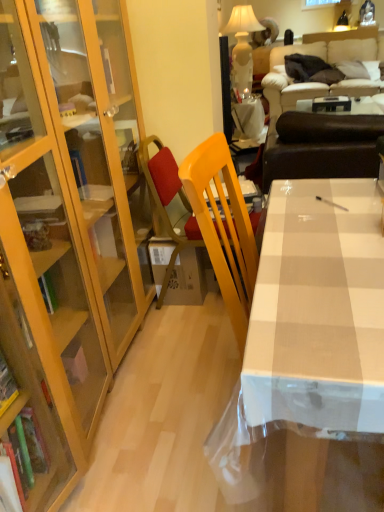
Where is `brown leather couch at upper right, the second studio couch viewed from the top`? The height and width of the screenshot is (512, 384). brown leather couch at upper right, the second studio couch viewed from the top is located at coordinates (321, 147).

What is the approximate height of white glossy table at center?

It is 3.38 feet.

Identify the location of yellow matte chair at center. pyautogui.click(x=168, y=201).

This screenshot has height=512, width=384. Describe the element at coordinates (326, 61) in the screenshot. I see `beige fabric couch at upper right, which ranks as the first studio couch in back-to-front order` at that location.

Image resolution: width=384 pixels, height=512 pixels. Describe the element at coordinates (242, 46) in the screenshot. I see `white ceramic lamp at upper center` at that location.

Measure the distance between white ceramic lamp at upper center and camera.

white ceramic lamp at upper center is 2.71 meters away from camera.

Find the location of a particular element. The height and width of the screenshot is (512, 384). white glossy table at upper center, which is the 1th table from back to front is located at coordinates (249, 119).

At what (x,y) coordinates should I click in order to perform the action: click on brown leather couch at upper right, acting as the first studio couch starting from the front. Please return your answer as a coordinate pair (x, y). The height and width of the screenshot is (512, 384). Looking at the image, I should click on (321, 147).

Is white glossy table at center wider or thinner than white glossy table at upper center, the second table viewed from the right?

Considering their sizes, white glossy table at center looks broader than white glossy table at upper center, the second table viewed from the right.

Which object is positioned more to the right, white glossy table at center or white glossy table at upper center, the second table in the front-to-back sequence?

From the viewer's perspective, white glossy table at upper center, the second table in the front-to-back sequence, appears more on the right side.

The image size is (384, 512). In order to click on desk on the left side of white glossy table at upper center, which is the 1th table from back to front in this screenshot , I will do `click(318, 310)`.

From the image's perspective, which is above, white glossy table at center or white glossy table at upper center, positioned as the first table in left-to-right order?

From the image's view, white glossy table at upper center, positioned as the first table in left-to-right order, is above.

Considering the sizes of objects yellow matte chair at center and white ceramic lamp at upper center in the image provided, who is shorter, yellow matte chair at center or white ceramic lamp at upper center?

yellow matte chair at center.

Considering their positions, is yellow matte chair at center located in front of or behind white ceramic lamp at upper center?

Clearly, yellow matte chair at center is in front of white ceramic lamp at upper center.

Choose the correct answer: Is yellow matte chair at center inside white ceramic lamp at upper center or outside it?

yellow matte chair at center is located beyond the bounds of white ceramic lamp at upper center.

Is yellow matte chair at center bigger than white ceramic lamp at upper center?

Incorrect, yellow matte chair at center is not larger than white ceramic lamp at upper center.

Looking at their sizes, would you say white glossy table at center is wider or thinner than white glossy table at center, the 1th table from the right?

In the image, white glossy table at center appears to be wider than white glossy table at center, the 1th table from the right.

From their relative heights in the image, would you say white glossy table at center is taller or shorter than white glossy table at center, marked as the 1th table in a front-to-back arrangement?

Clearly, white glossy table at center is taller compared to white glossy table at center, marked as the 1th table in a front-to-back arrangement.

Which is in front, point (320, 378) or point (302, 109)?

Point (320, 378)

Are white glossy table at center and white glossy table at center, the 1th table from the right, far apart?

Yes, white glossy table at center is far from white glossy table at center, the 1th table from the right.

You are a GUI agent. You are given a task and a screenshot of the screen. Output one action in this format:
    pyautogui.click(x=<x>, y=<y>)
    Task: Click on the studio couch that is the 1st object located above the white glossy table at center (from the image's perspective)
    This screenshot has height=512, width=384.
    Given the screenshot: What is the action you would take?
    (x=321, y=147)

Is brown leather couch at upper right, placed as the second studio couch when sorted from back to front, far away from white glossy table at center?

That's right, there is a large distance between brown leather couch at upper right, placed as the second studio couch when sorted from back to front, and white glossy table at center.

Could you measure the distance between brown leather couch at upper right, acting as the first studio couch starting from the front, and white glossy table at center?

They are 1.08 meters apart.

Based on the photo, who is shorter, brown leather couch at upper right, the second studio couch viewed from the top, or white glossy table at center?

Standing shorter between the two is brown leather couch at upper right, the second studio couch viewed from the top.

Can you confirm if white glossy table at center, the 1th table from the right, is positioned to the left of white ceramic lamp at upper center?

No.

From a real-world perspective, does white glossy table at center, the 1th table from the right, stand above white ceramic lamp at upper center?

Incorrect, from a real-world perspective, white glossy table at center, the 1th table from the right, is lower than white ceramic lamp at upper center.

Could you tell me if white glossy table at center, marked as the 1th table in a front-to-back arrangement, is facing white ceramic lamp at upper center?

No.

The image size is (384, 512). Find the location of `lamp behind the white glossy table at center, which is the second table in back-to-front order`. lamp behind the white glossy table at center, which is the second table in back-to-front order is located at coordinates (242, 46).

From the image's perspective, between white glossy table at upper center, which is the 1th table from back to front, and beige fabric couch at upper right, the 2th studio couch positioned from the bottom, which one is located above?

beige fabric couch at upper right, the 2th studio couch positioned from the bottom, is shown above in the image.

Is white glossy table at upper center, which is the 1th table from back to front, spatially inside beige fabric couch at upper right, arranged as the 2th studio couch when viewed from the front, or outside of it?

white glossy table at upper center, which is the 1th table from back to front, cannot be found inside beige fabric couch at upper right, arranged as the 2th studio couch when viewed from the front.

Does white glossy table at upper center, the second table viewed from the right, appear on the right side of beige fabric couch at upper right, arranged as the 2th studio couch when viewed from the front?

Incorrect, white glossy table at upper center, the second table viewed from the right, is not on the right side of beige fabric couch at upper right, arranged as the 2th studio couch when viewed from the front.

Is white glossy table at upper center, the second table in the front-to-back sequence, oriented towards beige fabric couch at upper right, which ranks as the first studio couch in back-to-front order?

No, white glossy table at upper center, the second table in the front-to-back sequence, is not facing towards beige fabric couch at upper right, which ranks as the first studio couch in back-to-front order.

Considering the positions of point (367, 59) and point (279, 141), is point (367, 59) closer or farther from the camera than point (279, 141)?

Clearly, point (367, 59) is more distant from the camera than point (279, 141).

Can you tell me how much beige fabric couch at upper right, the first studio couch when ordered from top to bottom, and brown leather couch at upper right, which appears as the first studio couch when ordered from the bottom, differ in facing direction?

The angular difference between beige fabric couch at upper right, the first studio couch when ordered from top to bottom, and brown leather couch at upper right, which appears as the first studio couch when ordered from the bottom, is 179 degrees.

Is beige fabric couch at upper right, the 2th studio couch positioned from the bottom, bigger or smaller than brown leather couch at upper right, which appears as the first studio couch when ordered from the bottom?

beige fabric couch at upper right, the 2th studio couch positioned from the bottom, is bigger than brown leather couch at upper right, which appears as the first studio couch when ordered from the bottom.

Can brown leather couch at upper right, placed as the second studio couch when sorted from back to front, be found inside beige fabric couch at upper right, arranged as the 2th studio couch when viewed from the front?

No, brown leather couch at upper right, placed as the second studio couch when sorted from back to front, is not surrounded by beige fabric couch at upper right, arranged as the 2th studio couch when viewed from the front.

Where is `the 2nd table above the white glossy table at center (from the image's perspective)`? Image resolution: width=384 pixels, height=512 pixels. the 2nd table above the white glossy table at center (from the image's perspective) is located at coordinates (249, 119).

This screenshot has height=512, width=384. Identify the location of lamp behind the yellow matte chair at center. pos(242,46).

Estimate the real-world distances between objects in this image. Which object is closer to white glossy table at center, yellow matte chair at center or white glossy table at center, which ranks as the 2th table in left-to-right order?

yellow matte chair at center.

Which object lies nearer to the anchor point beige fabric couch at upper right, the first studio couch when ordered from top to bottom, yellow matte chair at center or white glossy table at center?

Among the two, yellow matte chair at center is located nearer to beige fabric couch at upper right, the first studio couch when ordered from top to bottom.

Considering their positions, is beige fabric couch at upper right, the first studio couch when ordered from top to bottom, positioned closer to white ceramic lamp at upper center than white glossy table at upper center, the second table viewed from the right?

white glossy table at upper center, the second table viewed from the right, lies closer to white ceramic lamp at upper center than the other object.

Considering their positions, is white glossy table at upper center, positioned as the first table in left-to-right order, positioned further to white glossy table at center than white ceramic lamp at upper center?

white ceramic lamp at upper center is further to white glossy table at center.

From the image, which object appears to be nearer to white glossy table at upper center, the second table viewed from the right, white glossy table at center, marked as the 1th table in a front-to-back arrangement, or beige fabric couch at upper right, the 2th studio couch positioned from the bottom?

The object closer to white glossy table at upper center, the second table viewed from the right, is white glossy table at center, marked as the 1th table in a front-to-back arrangement.

Looking at the image, which one is located further to white glossy table at center, which ranks as the 2th table in left-to-right order, brown leather couch at upper right, acting as the first studio couch starting from the front, or yellow matte chair at center?

The object further to white glossy table at center, which ranks as the 2th table in left-to-right order, is yellow matte chair at center.

Estimate the real-world distances between objects in this image. Which object is closer to brown leather couch at upper right, which appears as the first studio couch when ordered from the bottom, yellow matte chair at center or beige fabric couch at upper right, which ranks as the first studio couch in back-to-front order?

yellow matte chair at center is positioned closer to the anchor brown leather couch at upper right, which appears as the first studio couch when ordered from the bottom.

From the picture: Which object lies nearer to the anchor point brown leather couch at upper right, which appears as the first studio couch when ordered from the bottom, yellow matte chair at center or white ceramic lamp at upper center?

yellow matte chair at center lies closer to brown leather couch at upper right, which appears as the first studio couch when ordered from the bottom, than the other object.

This screenshot has height=512, width=384. In order to click on studio couch located between white glossy table at center and beige fabric couch at upper right, which ranks as the first studio couch in back-to-front order, in the depth direction in this screenshot , I will do `click(321, 147)`.

I want to click on studio couch positioned between brown leather couch at upper right, placed as the second studio couch when sorted from back to front, and white ceramic lamp at upper center from near to far, so click(x=326, y=61).

Where is `chair positioned between white glossy table at center and white glossy table at upper center, the second table viewed from the right, from near to far`? The width and height of the screenshot is (384, 512). chair positioned between white glossy table at center and white glossy table at upper center, the second table viewed from the right, from near to far is located at coordinates (168, 201).

Locate an element on the screen. This screenshot has height=512, width=384. table between brown leather couch at upper right, which appears as the first studio couch when ordered from the bottom, and beige fabric couch at upper right, the 2th studio couch positioned from the bottom, from front to back is located at coordinates (364, 105).